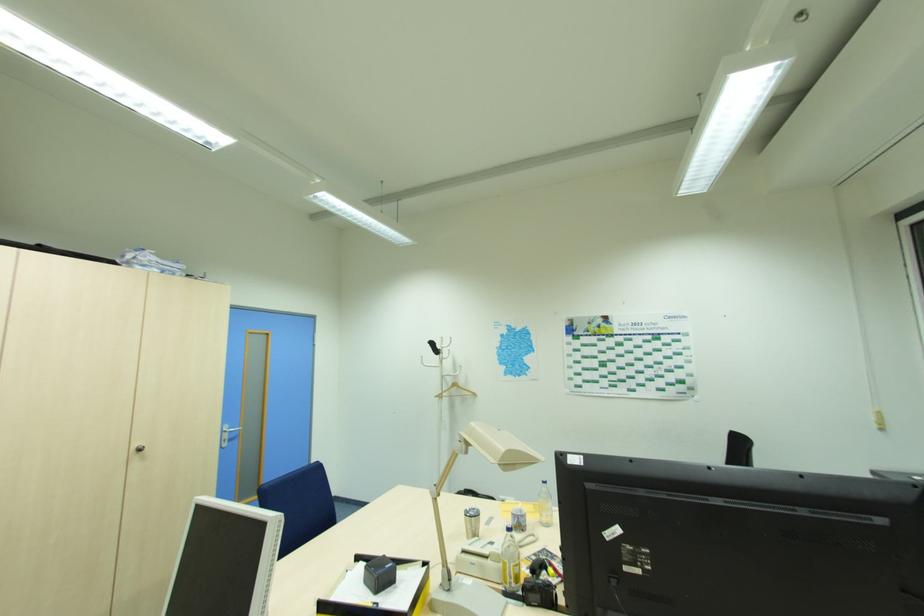
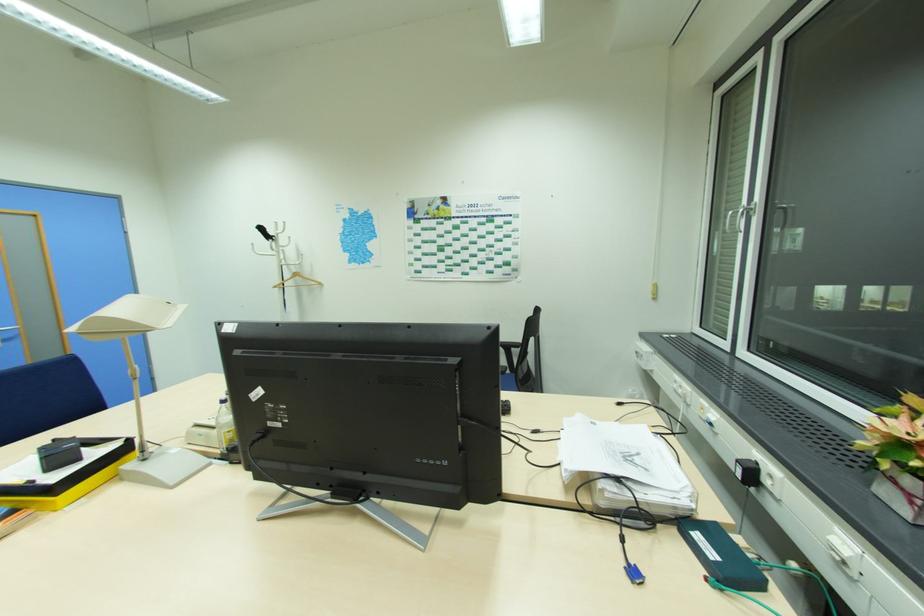
Locate, in the second image, the point that corresponds to point 439,397 in the first image.

(277, 286)